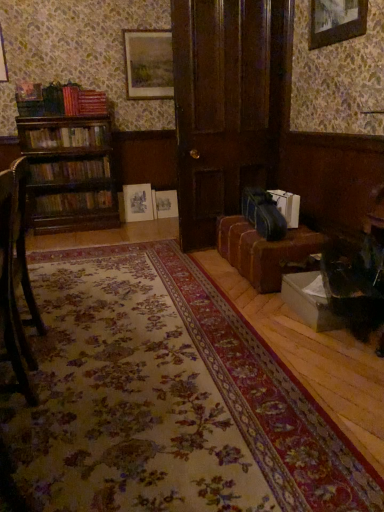
What is the approximate height of hardcover books at left, arranged as the second book when viewed from the front?

18.48 centimeters.

Locate an element on the screen. dark blue fabric suitcase at lower right is located at coordinates (263, 213).

What is the approximate width of matte wooden picture frame at upper center, which appears as the 2th picture frame when viewed from the front?

matte wooden picture frame at upper center, which appears as the 2th picture frame when viewed from the front, is 3.03 inches wide.

The height and width of the screenshot is (512, 384). I want to click on matte wooden picture frame at upper center, which appears as the 2th picture frame when viewed from the front, so click(x=148, y=64).

The image size is (384, 512). I want to click on wooden picture frame at upper center, the first picture frame when ordered from bottom to top, so click(336, 21).

Identify the location of wooden chair at left. (17, 277).

Locate an element on the screen. The image size is (384, 512). hardcover books at left, which is counted as the first book, starting from the left is located at coordinates (67, 137).

Is hardcover books at left, arranged as the 4th book when viewed from the right, oriented away from dark wood door at center?

That's not correct — hardcover books at left, arranged as the 4th book when viewed from the right, is not looking away from dark wood door at center.

Which book is the 3rd one when counting from the left side of the dark wood door at center? Please provide its 2D coordinates.

[(67, 137)]

Consider the image. Is hardcover books at left, arranged as the second book when viewed from the front, directly adjacent to dark wood door at center?

No, hardcover books at left, arranged as the second book when viewed from the front, is not with dark wood door at center.

Which of these two, hardcover books at left, which is counted as the first book, starting from the left, or dark wood door at center, stands shorter?

hardcover books at left, which is counted as the first book, starting from the left.

Considering the relative positions of matte wooden picture frame at upper center, the 1th picture frame from the top, and wooden chair at left in the image provided, is matte wooden picture frame at upper center, the 1th picture frame from the top, in front of wooden chair at left?

No.

Is matte wooden picture frame at upper center, which appears as the 2th picture frame when viewed from the front, inside or outside of wooden chair at left?

matte wooden picture frame at upper center, which appears as the 2th picture frame when viewed from the front, is not enclosed by wooden chair at left.

Is matte wooden picture frame at upper center, the second picture frame in the bottom-to-top sequence, oriented away from wooden chair at left?

No, matte wooden picture frame at upper center, the second picture frame in the bottom-to-top sequence,'s orientation is not away from wooden chair at left.

How different are the orientations of matte wooden picture frame at upper center, the second picture frame in the bottom-to-top sequence, and wooden chair at left in degrees?

They differ by 91.2 degrees in their facing directions.

Identify the location of table below the wooden bookshelf at left, which is counted as the 2th book, starting from the back (from a real-world perspective). The height and width of the screenshot is (512, 384). (265, 251).

Based on the photo, from a real-world perspective, is brown leather couch at lower right above or below wooden bookshelf at left, the second book viewed from the left?

brown leather couch at lower right is situated lower than wooden bookshelf at left, the second book viewed from the left, in the real world.

From the image's perspective, relative to wooden bookshelf at left, the third book positioned from the front, is brown leather couch at lower right above or below?

Clearly, from the image's perspective, brown leather couch at lower right is below wooden bookshelf at left, the third book positioned from the front.

Does brown leather couch at lower right have a greater width compared to wooden bookshelf at left, the third book viewed from the right?

Correct, the width of brown leather couch at lower right exceeds that of wooden bookshelf at left, the third book viewed from the right.

Is point (271, 40) positioned behind point (124, 54)?

No, (271, 40) is in front of (124, 54).

Does dark wood door at center have a greater width compared to matte wooden picture frame at upper center, the 1th picture frame when ordered from left to right?

Yes.

Which is more to the left, dark wood door at center or matte wooden picture frame at upper center, which appears as the 2th picture frame when viewed from the front?

From the viewer's perspective, matte wooden picture frame at upper center, which appears as the 2th picture frame when viewed from the front, appears more on the left side.

Is wooden bookshelf at left, which is counted as the 2th book, starting from the back, looking in the opposite direction of wooden picture frame at upper center, positioned as the second picture frame in back-to-front order?

No, wooden bookshelf at left, which is counted as the 2th book, starting from the back, is not facing away from wooden picture frame at upper center, positioned as the second picture frame in back-to-front order.

Does wooden bookshelf at left, placed as the third book when sorted from bottom to top, come in front of wooden picture frame at upper center, the 2th picture frame positioned from the left?

No.

How far apart are wooden bookshelf at left, the third book viewed from the right, and wooden picture frame at upper center, the 2th picture frame positioned from the left?

wooden bookshelf at left, the third book viewed from the right, is 2.52 meters away from wooden picture frame at upper center, the 2th picture frame positioned from the left.

Looking at this image, how different are the orientations of wooden bookshelf at left, the second book viewed from the left, and wooden picture frame at upper center, positioned as the second picture frame in top-to-bottom order, in degrees?

88.8 degrees separate the facing orientations of wooden bookshelf at left, the second book viewed from the left, and wooden picture frame at upper center, positioned as the second picture frame in top-to-bottom order.

Is matte wooden picture frame at upper center, acting as the second picture frame starting from the right, thinner than hardcover book at left, which is the second book in right-to-left order?

Indeed, matte wooden picture frame at upper center, acting as the second picture frame starting from the right, has a lesser width compared to hardcover book at left, which is the second book in right-to-left order.

From a real-world perspective, which object rests below the other?

In real-world perspective, hardcover book at left, the 1th book in the back-to-front sequence, is lower.

Is matte wooden picture frame at upper center, acting as the second picture frame starting from the right, touching hardcover book at left, the second book in the bottom-to-top sequence?

No, matte wooden picture frame at upper center, acting as the second picture frame starting from the right, is not touching hardcover book at left, the second book in the bottom-to-top sequence.

Is matte wooden picture frame at upper center, acting as the second picture frame starting from the right, oriented away from hardcover book at left, the second book in the bottom-to-top sequence?

No.

Starting from the dark wood door at center, which book is the 3rd one behind? Please provide its 2D coordinates.

[(70, 170)]

Is wooden bookshelf at left, the third book viewed from the right, looking in the opposite direction of dark wood door at center?

No, wooden bookshelf at left, the third book viewed from the right,'s orientation is not away from dark wood door at center.

Is point (70, 167) closer or farther from the camera than point (200, 187)?

Clearly, point (70, 167) is more distant from the camera than point (200, 187).

Is wooden bookshelf at left, the 2th book when ordered from top to bottom, not near dark wood door at center?

Absolutely, wooden bookshelf at left, the 2th book when ordered from top to bottom, is distant from dark wood door at center.

This screenshot has width=384, height=512. Find the location of `the 3rd book counting from the left side of the dark wood door at center`. the 3rd book counting from the left side of the dark wood door at center is located at coordinates (67, 137).

Where is `chair that is in front of the matte wooden picture frame at upper center, acting as the second picture frame starting from the right`? chair that is in front of the matte wooden picture frame at upper center, acting as the second picture frame starting from the right is located at coordinates (17, 277).

Estimate the real-world distances between objects in this image. Which object is further from wooden chair at left, brown leather couch at lower right or dark blue fabric suitcase at lower right?

Based on the image, dark blue fabric suitcase at lower right appears to be further to wooden chair at left.

From the image, which object appears to be nearer to brown leather couch at lower right, wooden chair at left or hardcover books at left, the first book in the top-to-bottom sequence?

Among the two, wooden chair at left is located nearer to brown leather couch at lower right.

Considering their positions, is floral carpet at center positioned closer to dark wood door at center than hardcover book at left, which appears as the 3th book when viewed from the left?

Based on the image, hardcover book at left, which appears as the 3th book when viewed from the left, appears to be nearer to dark wood door at center.

When comparing their distances from wooden bookshelf at left, which is counted as the 2th book, starting from the back, does wooden chair at left or brown leather couch at lower right seem closer?

brown leather couch at lower right.

Looking at the image, which one is located further to white paper bag at lower right, which is counted as the fourth book, starting from the left, hardcover books at left, which is the fourth book from bottom to top, or hardcover book at left, the 1th book in the back-to-front sequence?

hardcover book at left, the 1th book in the back-to-front sequence, is positioned further to the anchor white paper bag at lower right, which is counted as the fourth book, starting from the left.

Estimate the real-world distances between objects in this image. Which object is closer to hardcover books at left, arranged as the 4th book when viewed from the right, wooden chair at left or hardcover book at left, the fourth book positioned from the front?

hardcover book at left, the fourth book positioned from the front, is positioned closer to the anchor hardcover books at left, arranged as the 4th book when viewed from the right.

From the image, which object appears to be farther from wooden bookshelf at left, which is counted as the 2th book, starting from the back, dark wood door at center or matte wooden picture frame at upper center, acting as the second picture frame starting from the right?

Among the two, dark wood door at center is located further to wooden bookshelf at left, which is counted as the 2th book, starting from the back.

From the image, which object appears to be nearer to wooden chair at left, wooden bookshelf at left, the second book viewed from the left, or wooden picture frame at upper center, the 2th picture frame positioned from the left?

wooden picture frame at upper center, the 2th picture frame positioned from the left, lies closer to wooden chair at left than the other object.

Find the location of `table located between hardcover book at left, which is the second book in right-to-left order, and white paper bag at lower right, the first book ordered from the bottom, in the left-right direction`. table located between hardcover book at left, which is the second book in right-to-left order, and white paper bag at lower right, the first book ordered from the bottom, in the left-right direction is located at coordinates (265, 251).

I want to click on table between wooden chair at left and wooden bookshelf at left, the second book viewed from the left, in the front-back direction, so click(x=265, y=251).

At what (x,y) coordinates should I click in order to perform the action: click on door between wooden picture frame at upper center, the first picture frame when ordered from bottom to top, and dark blue fabric suitcase at lower right in the up-down direction. Please return your answer as a coordinate pair (x, y). Image resolution: width=384 pixels, height=512 pixels. Looking at the image, I should click on (226, 105).

Identify the location of chair positioned between floral carpet at center and wooden bookshelf at left, the third book viewed from the right, from near to far. (17, 277).